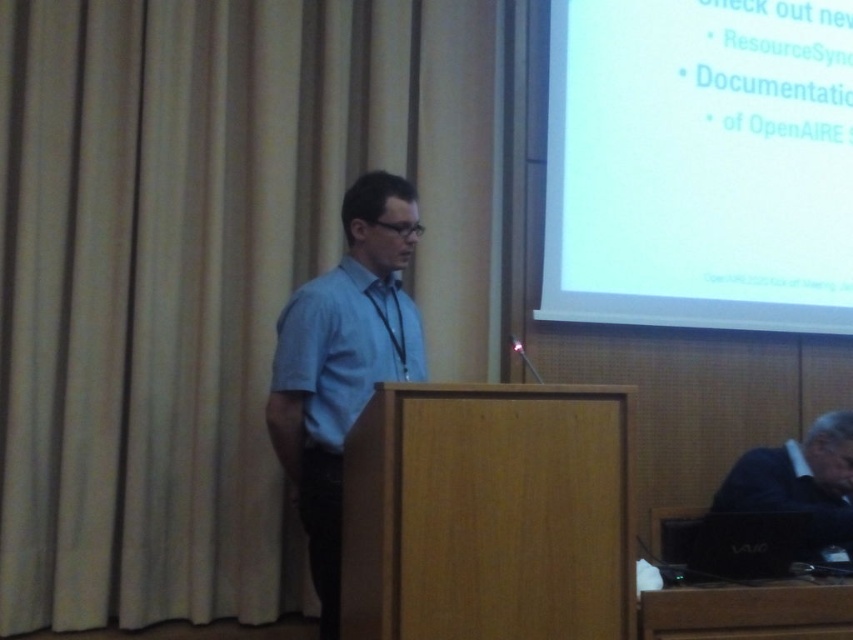
You are an attendee sitting in the front row of the presentation. You want to take a photo of the speaker and the screen simultaneously. Is the white glossy screen at upper right positioned in a way that you can capture both the light blue cotton dress shirt at center and the screen in the same frame?

The white glossy screen at upper right is located above the light blue cotton dress shirt at center, so if you position your camera to include both the upper right area and the center, you should be able to capture both in the same frame.

You are sitting in the audience and want to focus on the presenter. Which object is closer to your line of sight between the white glossy screen at upper right and the light blue shirt at center?

The light blue shirt at center is closer to your line of sight because the white glossy screen at upper right is positioned over it, meaning the screen is further away from the audience compared to the presenter wearing the light blue shirt at center.

You are an attendee at the presentation and want to take a photo of the speaker. However, there is a black plastic laptop at lower right in the way. Can you move it to the side to get a clear shot of the light blue shirt at center?

The light blue shirt at center is much taller than the black plastic laptop at lower right, so moving the black plastic laptop at lower right would not block the view of the light blue shirt at center.